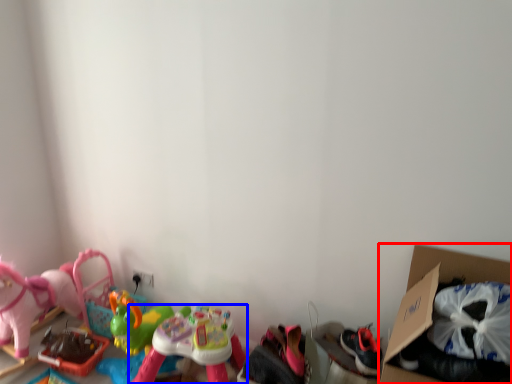
Question: Which object is closer to the camera taking this photo, cardboard box (highlighted by a red box) or toy (highlighted by a blue box)?

Choices:
 (A) cardboard box
 (B) toy

Answer: (A)